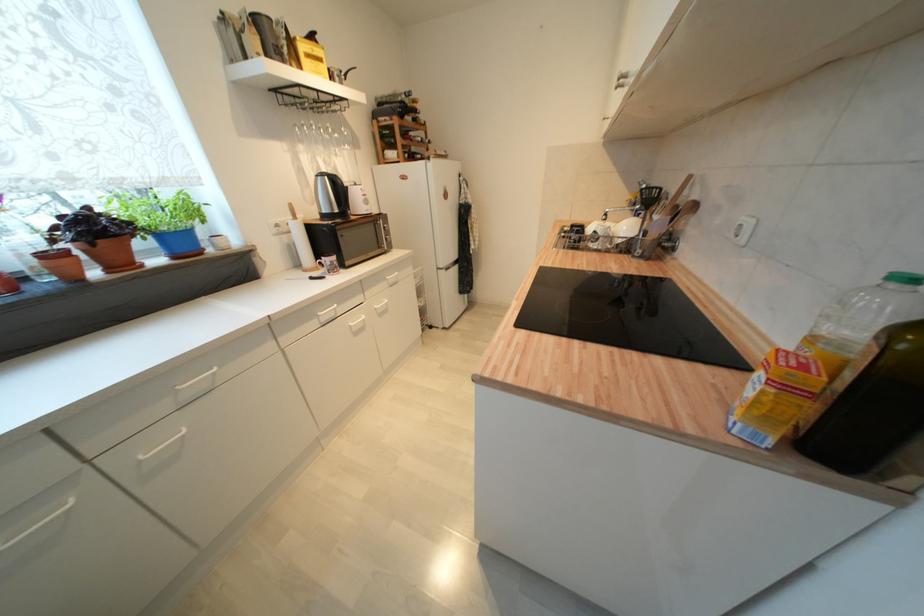
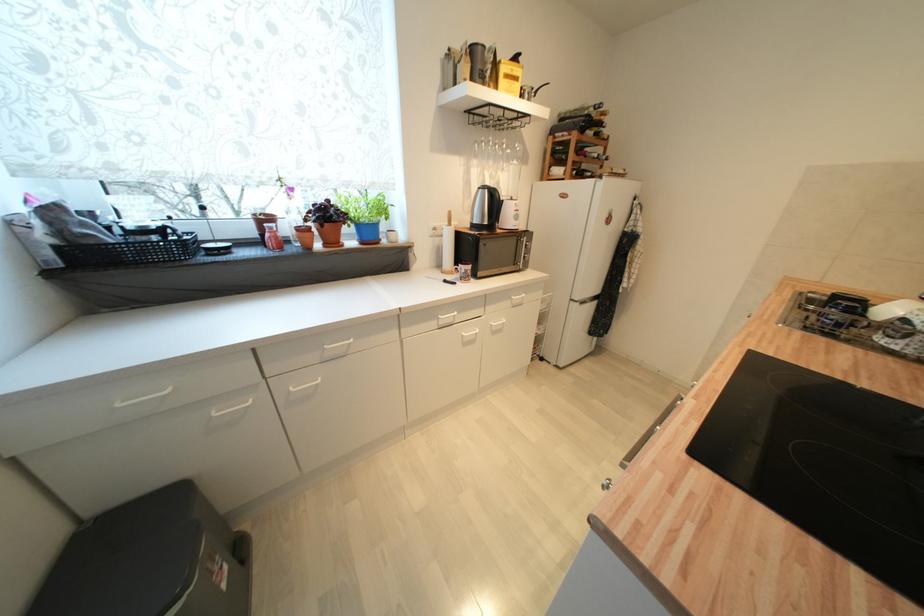
Where in the second image is the point corresponding to point (360, 187) from the first image?

(517, 201)